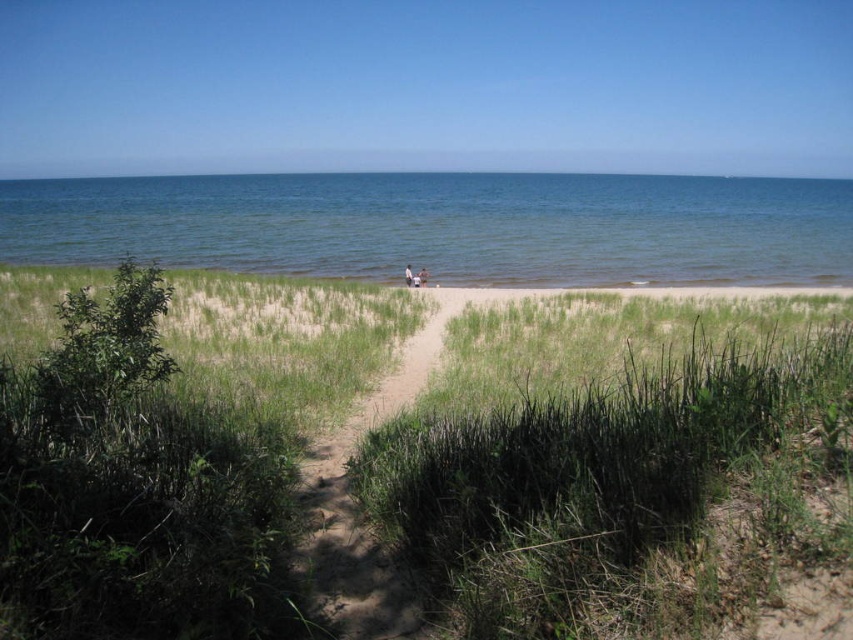
You are a photographer carrying a camera bag that is 8 inches wide. You want to place it between the light brown wooden bench at center and the light brown sand at center. Is there enough space for the bag?

The light brown wooden bench at center and the light brown sand at center are 7.66 inches apart, so the 8 inch wide camera bag will not fit between them.

You are planning to place a small potted plant on the light brown sand at center. The potted plant is 30 cm wide. Can the light brown wooden bench at center accommodate the potted plant if you place it there instead?

The light brown wooden bench at center has a width larger than the light brown sand at center. Since the potted plant is 30 cm wide, and the bench is wider than the sand, it can accommodate the potted plant.

In the scene shown: You are a photographer planning to capture a closeup shot of the light brown wooden bench at center and the light brown sand at center. Which object should you focus on to ensure the larger one is in sharp focus?

The light brown wooden bench at center has a larger size compared to the light brown sand at center, so you should focus on the light brown wooden bench at center to ensure the larger object is in sharp focus.